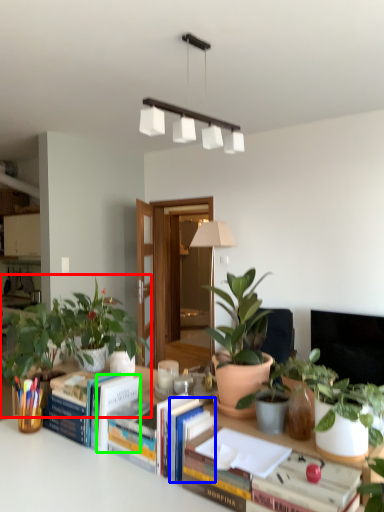
Question: Considering the real-world distances, which object is closest to houseplant (highlighted by a red box)? paperback book (highlighted by a blue box) or paperback book (highlighted by a green box).

Choices:
 (A) paperback book
 (B) paperback book

Answer: (B)